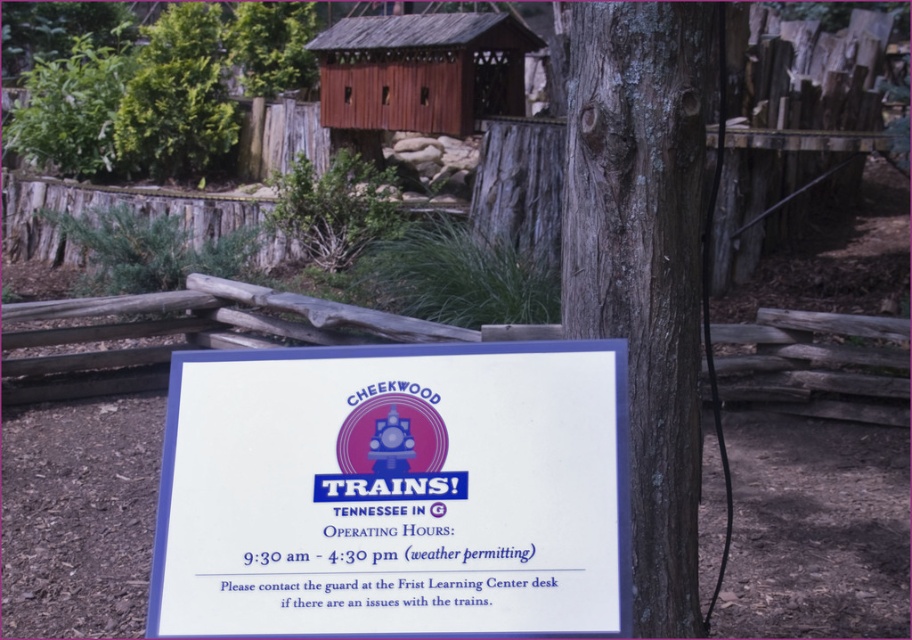
Is white paper sign at center to the right of gray bark tree trunk at center from the viewer's perspective?

Incorrect, white paper sign at center is not on the right side of gray bark tree trunk at center.

Between white paper sign at center and gray bark tree trunk at center, which one appears on the left side from the viewer's perspective?

From the viewer's perspective, white paper sign at center appears more on the left side.

The height and width of the screenshot is (640, 912). Find the location of `white paper sign at center`. white paper sign at center is located at coordinates (392, 492).

Identify the location of white paper sign at center. The width and height of the screenshot is (912, 640). (392, 492).